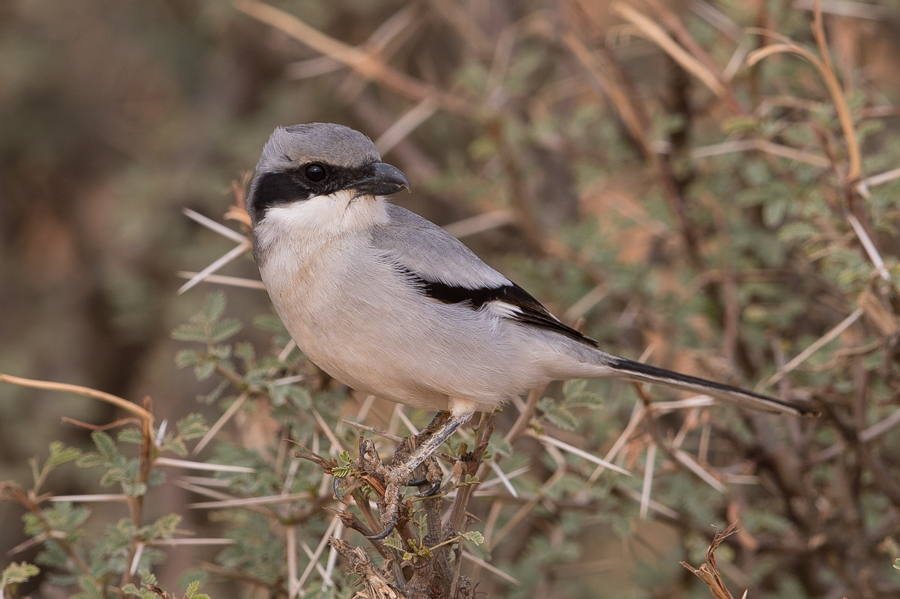
Locate an element on the screen. left corner is located at coordinates [6, 9].